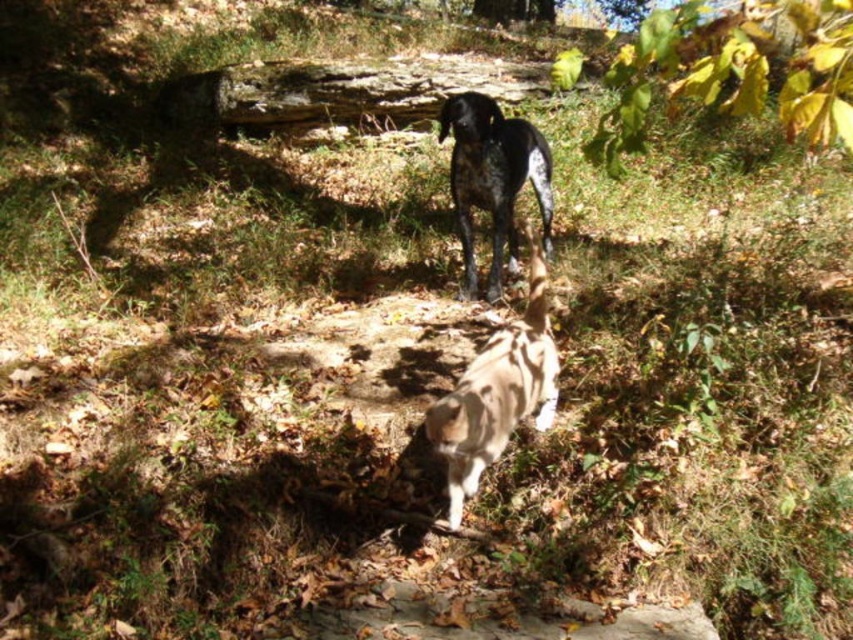
Who is higher up, spotted fur dog at center or speckled fur dog at upper center?

speckled fur dog at upper center

Identify the location of spotted fur dog at center. The height and width of the screenshot is (640, 853). (497, 392).